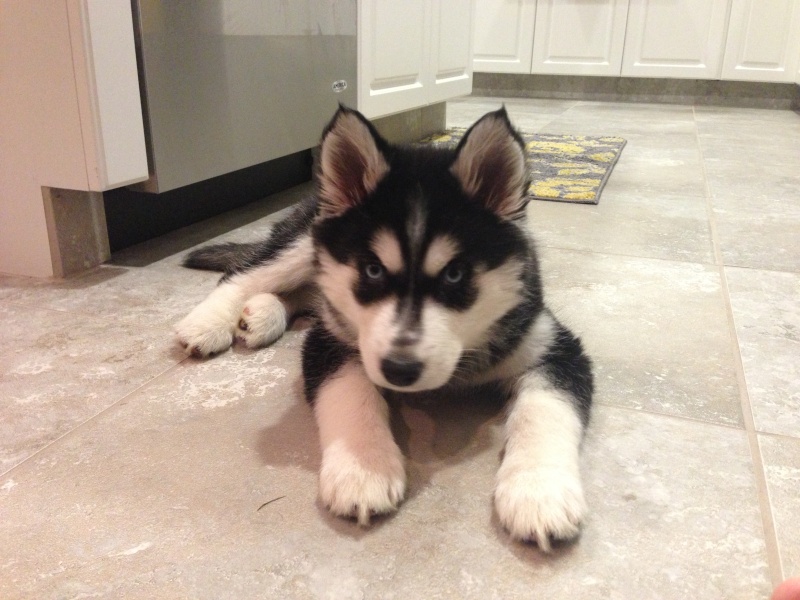
At what (x,y) coordinates should I click in order to perform the action: click on rug. Please return your answer as a coordinate pair (x, y). The height and width of the screenshot is (600, 800). Looking at the image, I should click on (558, 154).